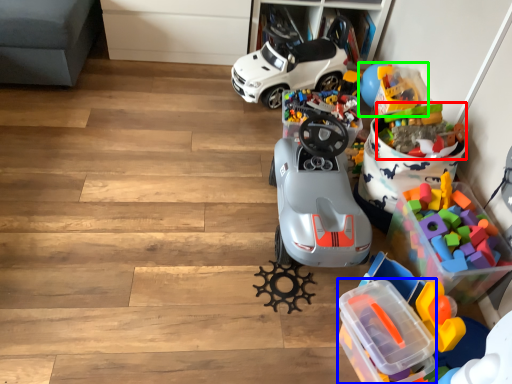
Question: Which object is the closest to the toy (highlighted by a red box)? Choose among these: storage box (highlighted by a blue box) or toy (highlighted by a green box).

Choices:
 (A) storage box
 (B) toy

Answer: (B)